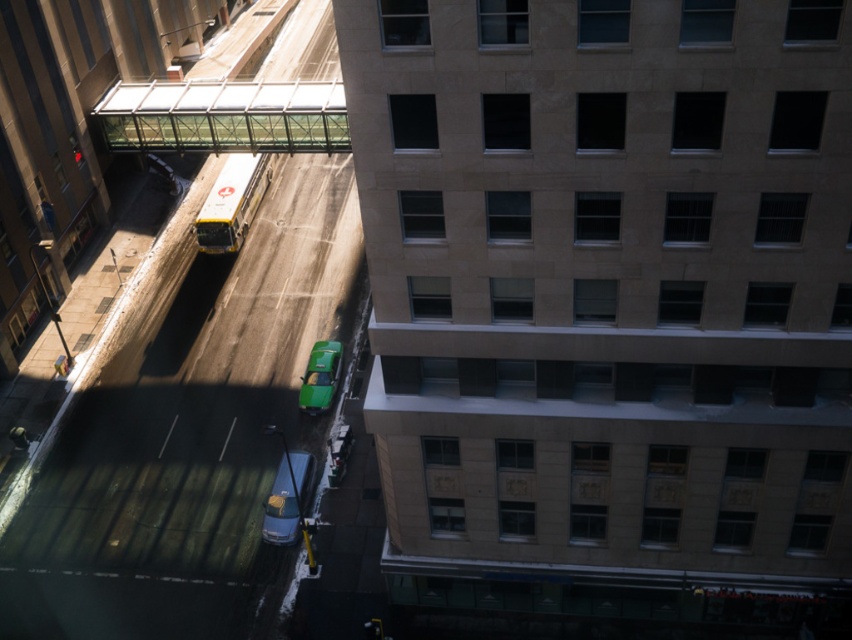
Does point (202, 250) come in front of point (338, 369)?

No, it is behind (338, 369).

The image size is (852, 640). I want to click on white glossy bus at center, so (232, 202).

Measure the distance from white glossy bus at center to metallic silver car at center.

The distance of white glossy bus at center from metallic silver car at center is 77.99 feet.

Between white glossy bus at center and metallic silver car at center, which one is positioned higher?

white glossy bus at center is above.

What do you see at coordinates (232, 202) in the screenshot?
I see `white glossy bus at center` at bounding box center [232, 202].

Locate an element on the screen. white glossy bus at center is located at coordinates (232, 202).

Where is `metallic silver car at center`? The image size is (852, 640). metallic silver car at center is located at coordinates (288, 499).

Between metallic silver car at center and green matte taxi at center, which one is positioned lower?

metallic silver car at center is lower down.

Where is `metallic silver car at center`? metallic silver car at center is located at coordinates (288, 499).